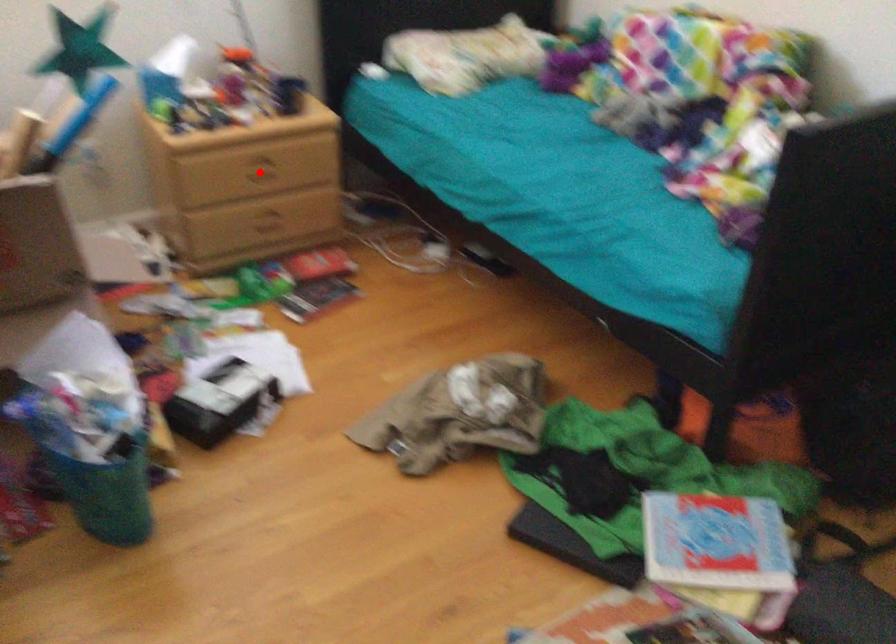
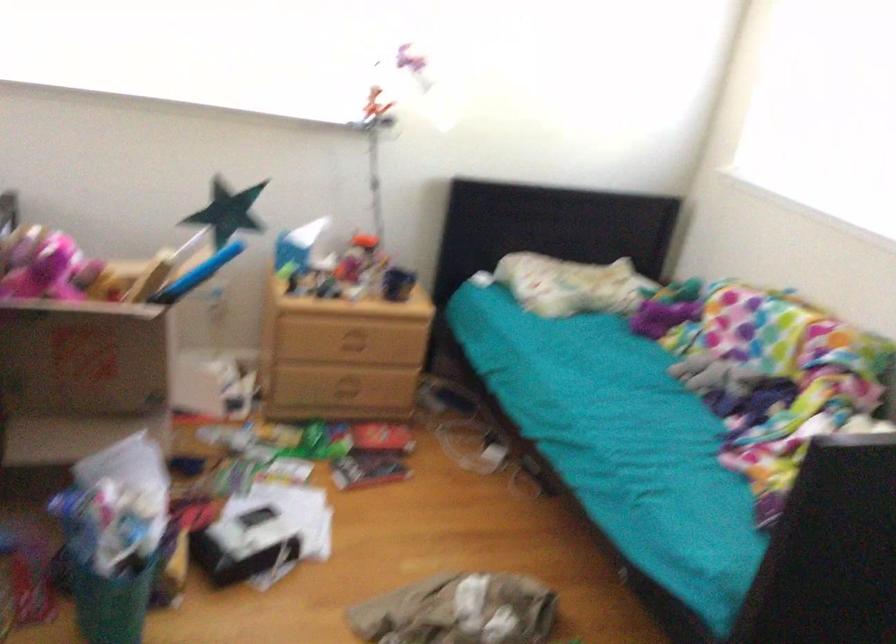
Find the pixel in the second image that matches the highlighted location in the first image.

(352, 343)